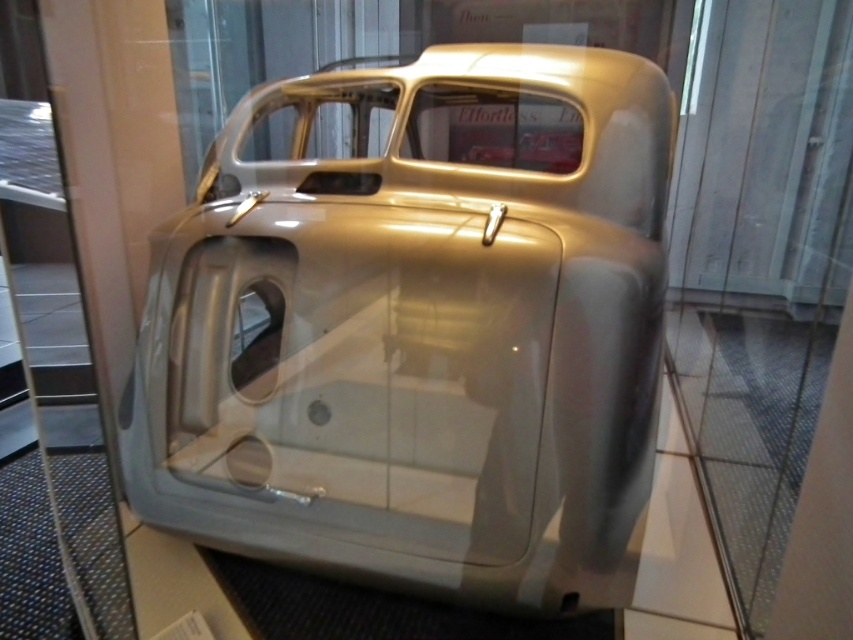
Looking at this image, can you confirm if metallic silver car at center is taller than transparent glass door at center?

No.

Between metallic silver car at center and transparent glass door at center, which one has more height?

Standing taller between the two is transparent glass door at center.

Identify the location of metallic silver car at center. (416, 326).

Locate an element on the screen. This screenshot has width=853, height=640. metallic silver car at center is located at coordinates (416, 326).